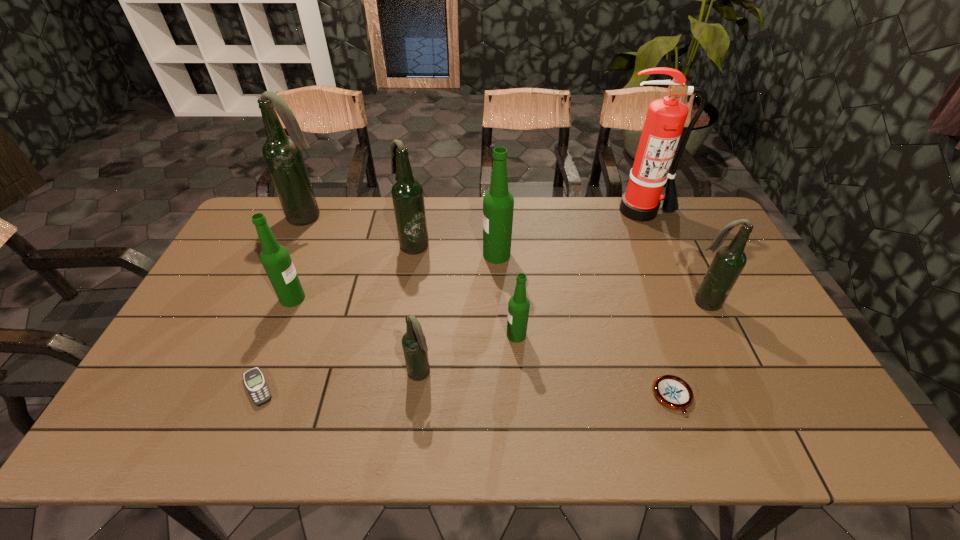
Image resolution: width=960 pixels, height=540 pixels. I want to click on blank region between the compass and the red fire extinguisher, so click(657, 303).

What are the coordinates of `unoccupied area between the smallest green beer bottle and the beeper` in the screenshot? It's located at (387, 361).

The height and width of the screenshot is (540, 960). I want to click on object that is the ninth closest one to the gray beeper, so click(x=665, y=119).

This screenshot has width=960, height=540. I want to click on object identified as the second closest to the rightmost dark beer bottle, so click(x=665, y=119).

Locate an element on the screen. This screenshot has width=960, height=540. beer bottle that is the sixth closest to the beeper is located at coordinates (498, 203).

Where is `beer bottle identified as the fifth closest to the second farthest green beer bottle`? beer bottle identified as the fifth closest to the second farthest green beer bottle is located at coordinates [x=518, y=307].

Where is `dark beer bottle that is the second closest one to the red fire extinguisher`? The height and width of the screenshot is (540, 960). dark beer bottle that is the second closest one to the red fire extinguisher is located at coordinates (407, 193).

Select which dark beer bottle is the closest to the leftmost green beer bottle. Please provide its 2D coordinates. Your answer should be formatted as a tuple, i.e. [(x, y)], where the tuple contains the x and y coordinates of a point satisfying the conditions above.

[(407, 193)]

Identify which green beer bottle is the nearest to the compass. Please provide its 2D coordinates. Your answer should be formatted as a tuple, i.e. [(x, y)], where the tuple contains the x and y coordinates of a point satisfying the conditions above.

[(518, 307)]

Identify which green beer bottle is located as the second nearest to the nearest green beer bottle. Please provide its 2D coordinates. Your answer should be formatted as a tuple, i.e. [(x, y)], where the tuple contains the x and y coordinates of a point satisfying the conditions above.

[(275, 258)]